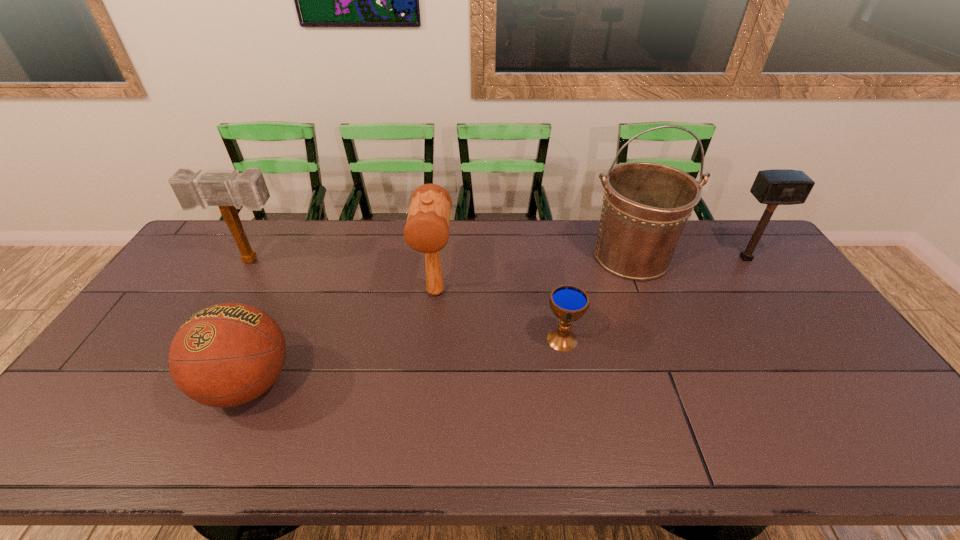
At what (x,y) coordinates should I click in order to perform the action: click on unoccupied position between the rightmost mallet and the leftmost mallet. Please return your answer as a coordinate pair (x, y). The width and height of the screenshot is (960, 540). Looking at the image, I should click on (499, 260).

Find the location of a particular element. Image resolution: width=960 pixels, height=540 pixels. vacant region between the nearest mallet and the second object from right to left is located at coordinates (534, 274).

Identify the location of unoccupied area between the second shortest object and the fourth object from right to left. This screenshot has width=960, height=540. (342, 338).

Identify which object is the fourth nearest to the fourth object from right to left. Please provide its 2D coordinates. Your answer should be formatted as a tuple, i.e. [(x, y)], where the tuple contains the x and y coordinates of a point satisfying the conditions above.

[(229, 191)]

Point out which object is positioned as the third nearest to the nearest mallet. Please provide its 2D coordinates. Your answer should be formatted as a tuple, i.e. [(x, y)], where the tuple contains the x and y coordinates of a point satisfying the conditions above.

[(646, 205)]

Identify which mallet is the second closest to the chalice. Please provide its 2D coordinates. Your answer should be formatted as a tuple, i.e. [(x, y)], where the tuple contains the x and y coordinates of a point satisfying the conditions above.

[(774, 187)]

The image size is (960, 540). Identify the location of the second closest mallet to the tallest object. (427, 227).

Find the location of a particular element. Image resolution: width=960 pixels, height=540 pixels. vacant space that satisfies the following two spatial constraints: 1. on the back side of the fourth object from left to right; 2. on the right side of the tallest object is located at coordinates (547, 257).

Where is `vacant space that satisfies the following two spatial constraints: 1. on the back side of the shortest object; 2. on the left side of the basketball`? vacant space that satisfies the following two spatial constraints: 1. on the back side of the shortest object; 2. on the left side of the basketball is located at coordinates (269, 339).

At what (x,y) coordinates should I click in order to perform the action: click on free location that satisfies the following two spatial constraints: 1. on the strike surface of the chalice; 2. on the left side of the nearest mallet. Please return your answer as a coordinate pair (x, y). Looking at the image, I should click on (431, 339).